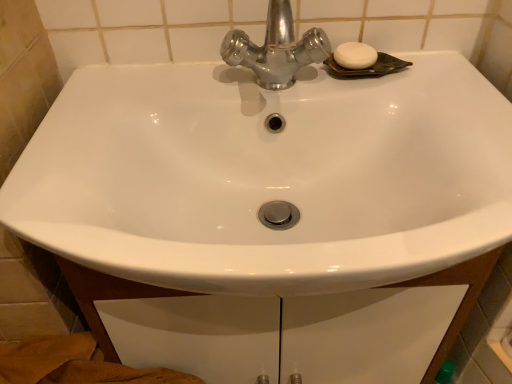
Identify the location of vacant space in shiny metallic faucet at upper center (from a real-world perspective). (277, 92).